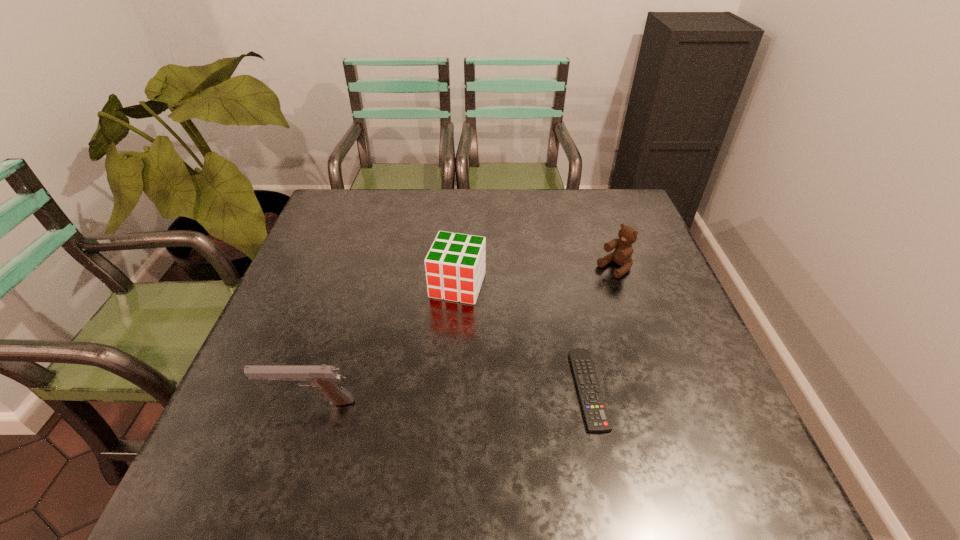
The image size is (960, 540). I want to click on vacant region between the teddy bear and the second object from left to right, so click(536, 276).

Identify the location of vacant space that is in between the leftmost object and the third object from left to right. (448, 395).

Locate an element on the screen. free area in between the leftmost object and the remote control is located at coordinates (448, 395).

Where is `the second closest object to the teddy bear`? This screenshot has height=540, width=960. the second closest object to the teddy bear is located at coordinates (455, 266).

Choose which object is the nearest neighbor to the second object from left to right. Please provide its 2D coordinates. Your answer should be formatted as a tuple, i.e. [(x, y)], where the tuple contains the x and y coordinates of a point satisfying the conditions above.

[(595, 413)]

This screenshot has width=960, height=540. Identify the location of free spot that satisfies the following two spatial constraints: 1. on the back side of the shortest object; 2. on the left side of the rightmost object. (563, 268).